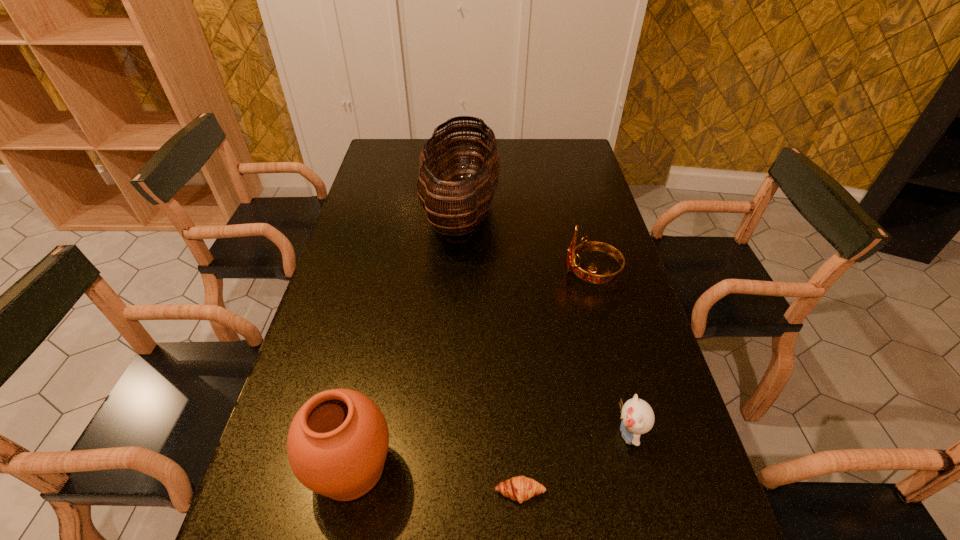
This screenshot has width=960, height=540. In order to click on basket in this screenshot , I will do `click(470, 198)`.

This screenshot has width=960, height=540. In order to click on urn in this screenshot , I will do coord(337,444).

The width and height of the screenshot is (960, 540). Find the location of `tiara`. tiara is located at coordinates (573, 251).

Where is `the fourth tallest object`? the fourth tallest object is located at coordinates (637, 416).

The height and width of the screenshot is (540, 960). Find the location of `the shortest object`. the shortest object is located at coordinates (520, 488).

Where is `vacant position located 0.100m on the back of the basket`? This screenshot has width=960, height=540. vacant position located 0.100m on the back of the basket is located at coordinates (464, 157).

The image size is (960, 540). I want to click on vacant space located on the back of the urn, so click(x=383, y=316).

This screenshot has width=960, height=540. Identify the location of vacant space located on the front-facing side of the third tallest object. (477, 273).

Find the location of a particular element. free location located on the front-facing side of the third tallest object is located at coordinates 498,273.

I want to click on vacant space situated on the front-facing side of the third tallest object, so pyautogui.click(x=501, y=273).